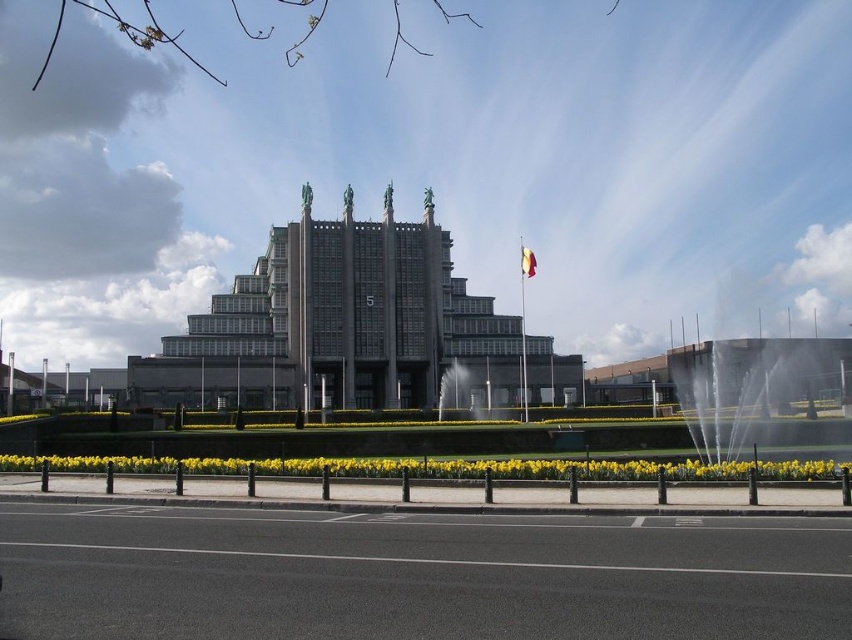
Is white water at right wider than yellow fabric flag at center?

Yes.

Which is more to the right, white water at right or yellow fabric flag at center?

Positioned to the right is white water at right.

Where is `white water at right`? This screenshot has width=852, height=640. white water at right is located at coordinates (755, 387).

Who is more forward, [545,477] or [476,396]?

Point [545,477]

This screenshot has height=640, width=852. What do you see at coordinates (436, 467) in the screenshot?
I see `yellow matte daffodil at lower center` at bounding box center [436, 467].

Find the location of a particular element. The width and height of the screenshot is (852, 640). yellow matte daffodil at lower center is located at coordinates (436, 467).

In the scene shown: Is white water at right in front of clear glass water at center?

Yes, it is.

Is point (836, 369) positioned behind point (459, 406)?

Yes, point (836, 369) is behind point (459, 406).

I want to click on white water at right, so click(755, 387).